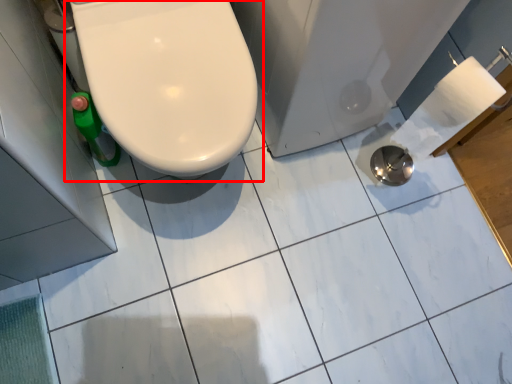
Question: From the image's perspective, where is toilet (annotated by the red box) located relative to bath?

Choices:
 (A) above
 (B) below

Answer: (B)